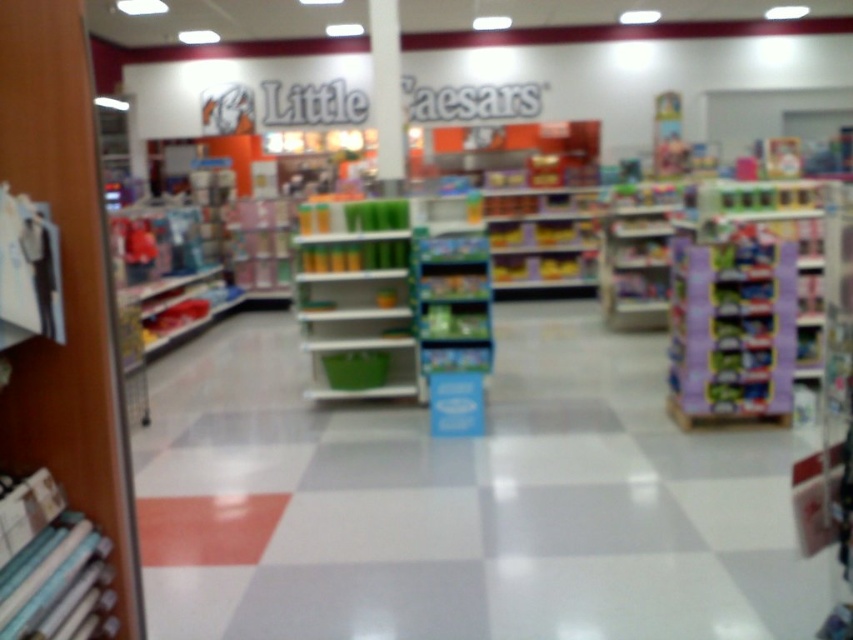
You are a customer in the Little Caesars store and want to reach the white glossy pillar at center. The green plastic shelves at center are blocking your path. Can you walk around them to get to the pillar?

The green plastic shelves at center are in front of the white glossy pillar at center, so you can walk around the green plastic shelves at center to access the pillar.

You are standing in the Little Caesars store section and want to place a small box exactly where the white glossy floor at center is located. What are the coordinates of the spot where you should place the box?

The coordinates for the white glossy floor at center are at point (462, 500).

You are a delivery person entering the Little Caesars store and need to place a purple cardboard candy at right on the white glossy floor at center. Can you do this without needing to adjust the height of either?

The white glossy floor at center has a lesser height compared to purple cardboard candy at right, so you can place the purple cardboard candy at right directly onto the white glossy floor at center without needing to adjust their heights since the candy is taller but the floor is lower.